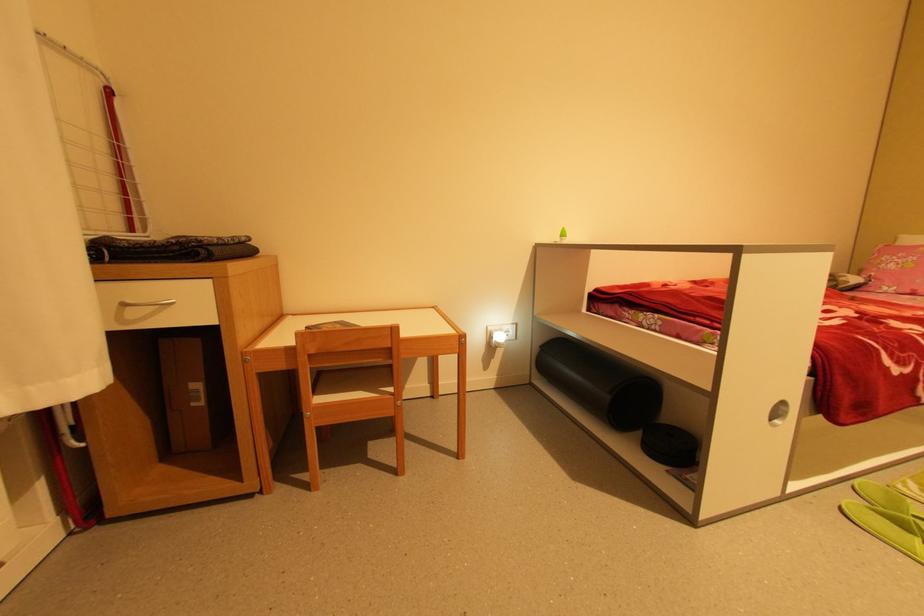
Find where to pull the silver drawer handle. Please return your answer as a coordinate pair (x, y).

(147, 304)